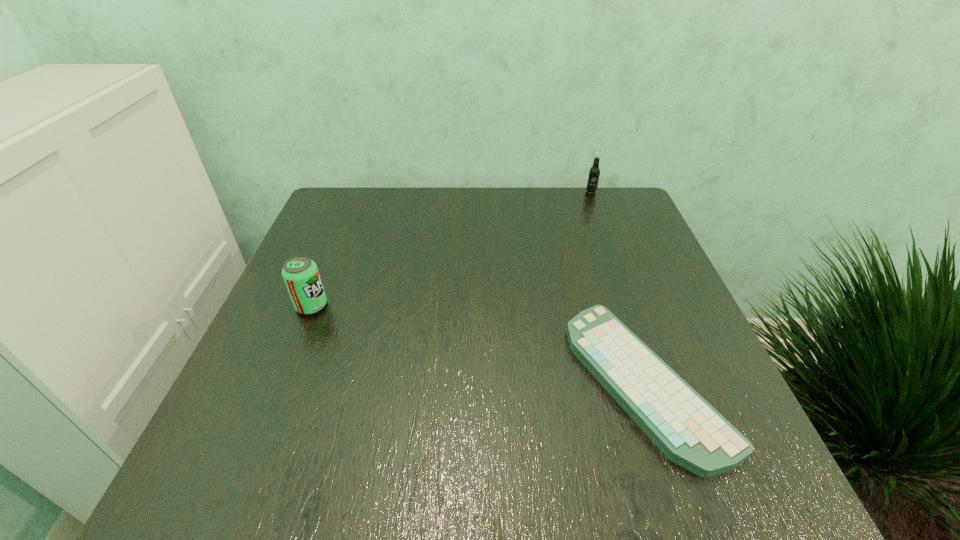
This screenshot has height=540, width=960. Find the location of `computer keyboard that is at the right edge`. computer keyboard that is at the right edge is located at coordinates (691, 433).

Where is `object that is at the far right corner`? object that is at the far right corner is located at coordinates (593, 177).

Where is `object that is at the near right corner`? object that is at the near right corner is located at coordinates (691, 433).

Find the location of `vacant region at the far edge of the desktop`. vacant region at the far edge of the desktop is located at coordinates (569, 188).

Identify the location of vacant space at the near edge of the desktop. Image resolution: width=960 pixels, height=540 pixels. (433, 460).

Locate an element on the screen. The height and width of the screenshot is (540, 960). free spot at the right edge of the desktop is located at coordinates (631, 285).

The height and width of the screenshot is (540, 960). I want to click on free space at the near left corner of the desktop, so click(220, 495).

Identify the location of vacant space at the near right corner. The height and width of the screenshot is (540, 960). (674, 476).

This screenshot has height=540, width=960. In order to click on free space between the leftmost object and the farthest object in this screenshot , I will do `click(451, 248)`.

Find the location of a particular element. This screenshot has height=540, width=960. free area in between the computer keyboard and the farthest object is located at coordinates (618, 286).